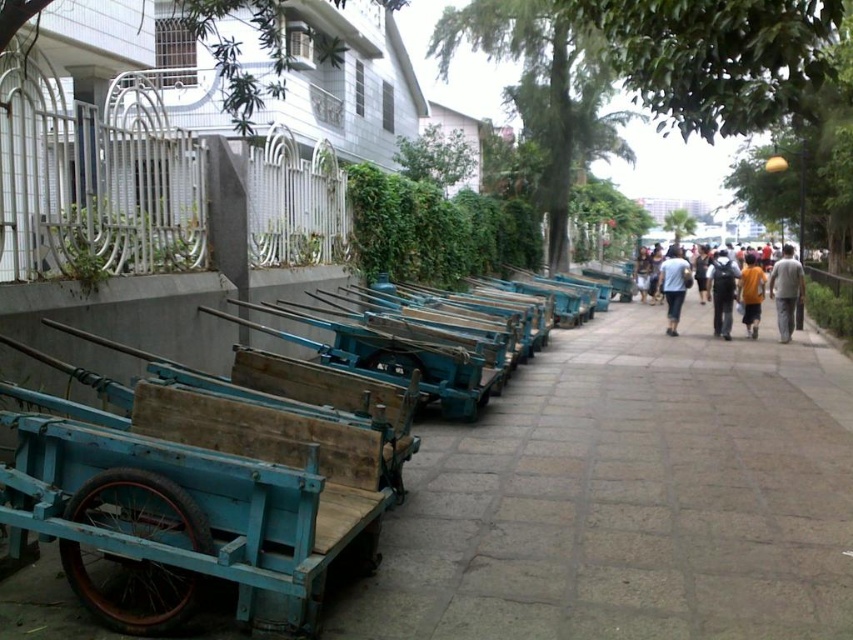
Question: Which point is farther to the camera?

Choices:
 (A) dark blue fabric jacket at center-right
 (B) denim shorts at center
 (C) light gray fabric shirt at center

Answer: (B)

Question: In this image, where is yellow cotton shirt at center located relative to gray cotton pants at right?

Choices:
 (A) right
 (B) left

Answer: (B)

Question: Which object appears farthest from the camera in this image?

Choices:
 (A) gray cotton pants at right
 (B) yellow cotton shirt at center
 (C) denim shorts at center
 (D) dark blue fabric jacket at center-right

Answer: (C)

Question: Is dark blue fabric jacket at center-right above light gray fabric shirt at center?

Choices:
 (A) yes
 (B) no

Answer: (B)

Question: Which point appears closest to the camera in this image?

Choices:
 (A) (784, 275)
 (B) (709, 264)

Answer: (A)

Question: In this image, where is yellow cotton shirt at center located relative to yellow t-shirt at right?

Choices:
 (A) right
 (B) left

Answer: (A)